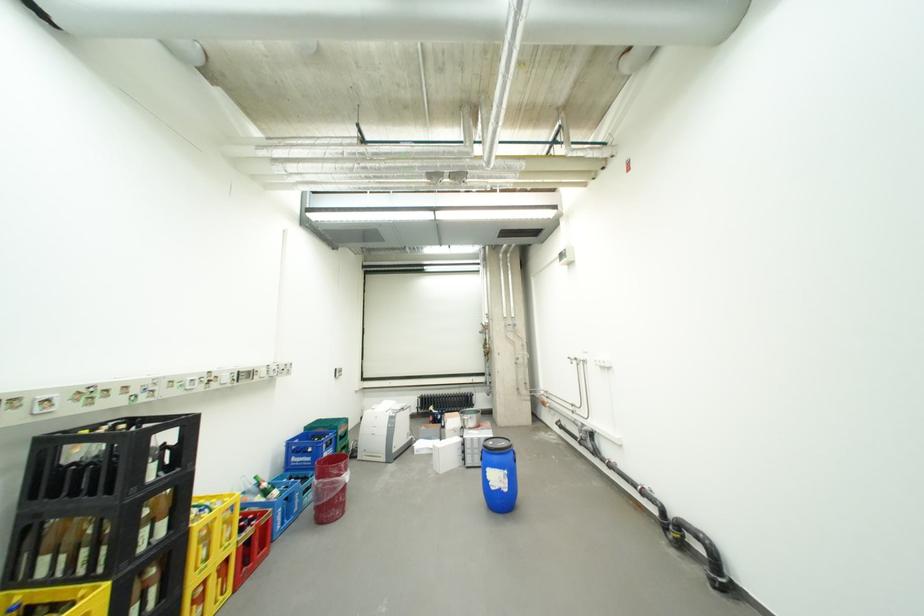
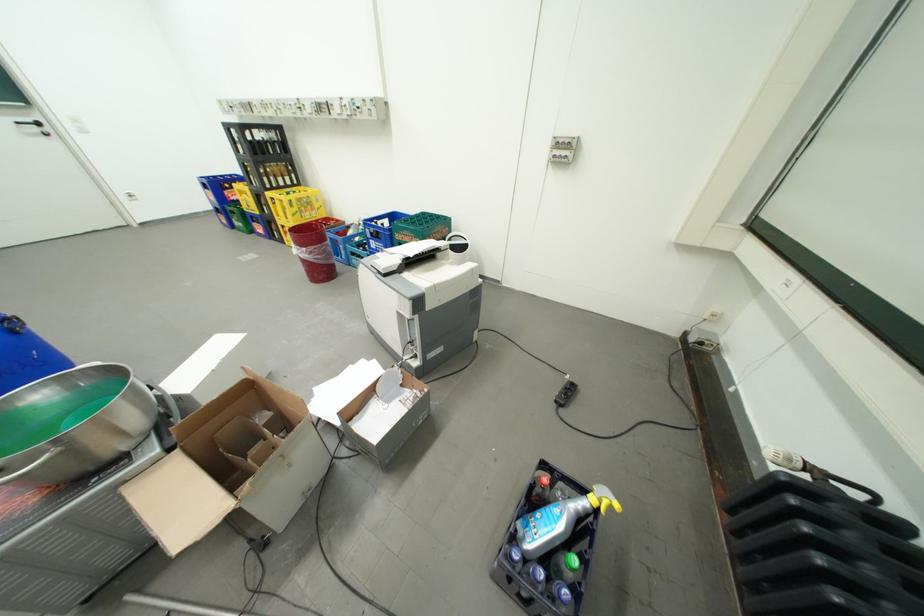
In the second image, find the point that corresponds to point (334, 455) in the first image.

(381, 241)